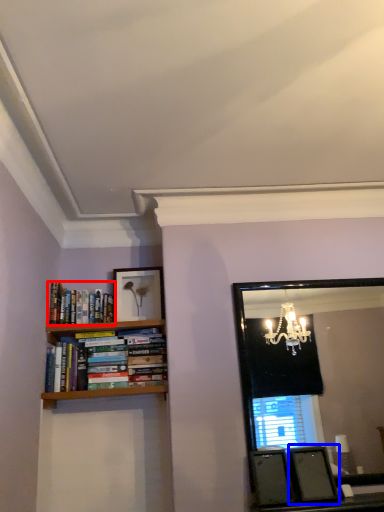
Question: Which of the following is the closest to the observer, book (highlighted by a red box) or picture frame (highlighted by a blue box)?

Choices:
 (A) book
 (B) picture frame

Answer: (B)